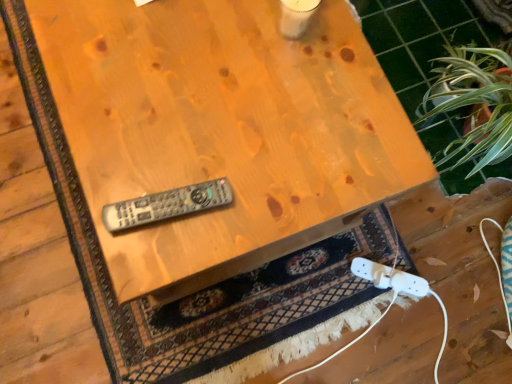
The height and width of the screenshot is (384, 512). Identify the location of free spot to the right of gray plastic remote at center. (248, 209).